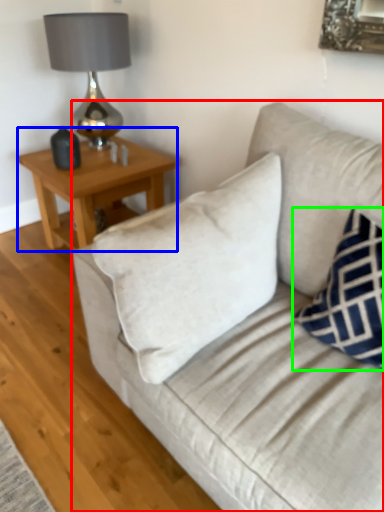
Question: Considering the real-world distances, which object is closest to studio couch (highlighted by a red box)? table (highlighted by a blue box) or pillow (highlighted by a green box).

Choices:
 (A) table
 (B) pillow

Answer: (B)